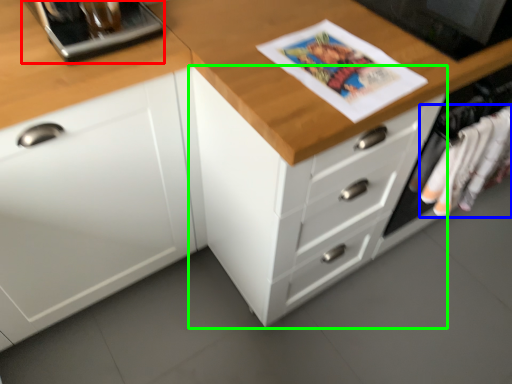
Question: Estimate the real-world distances between objects in this image. Which object is farther from appliance (highlighted by a red box), clothing (highlighted by a blue box) or chest of drawers (highlighted by a green box)?

Choices:
 (A) clothing
 (B) chest of drawers

Answer: (A)